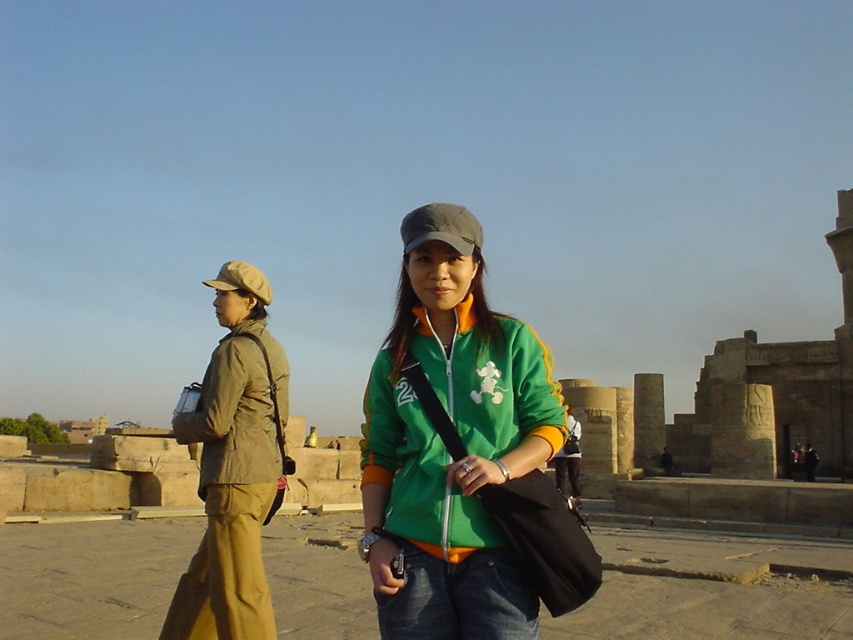
You are a tour guide at the archaeological site. You notice a tourist wearing a khaki fabric jacket at left. Where should they go to find the restroom? The restroom is located at point (238,410). Please provide the direction relative to the khaki fabric jacket at left.

The restroom is located at point (238,410), which marks the direction of the khaki fabric jacket at left. Therefore, the tourist should head towards the location marked by the khaki fabric jacket at left to find the restroom.

You are a tour guide at the archaeological site. You notice two visitors. One is wearing a khaki fabric jacket at left and the other has a green fabric baseball cap at center. If you want to address the visitor closer to the entrance, which one should you approach?

The khaki fabric jacket at left is to the left of the green fabric baseball cap at center. Since the entrance is typically on the left side, you should approach the visitor wearing the khaki fabric jacket at left.

From the picture: You are a tour guide at the archaeological site and need to ensure visitors maintain a minimum distance of 15 meters between each other for safety. You see the tan fabric jacket at left and the tan fabric baseball cap at left. Can you confirm if they are following the safety guidelines?

The tan fabric jacket at left and the tan fabric baseball cap at left are 14.98 meters apart from each other, which is less than the required 15 meters. Therefore, they are not following the safety guidelines.